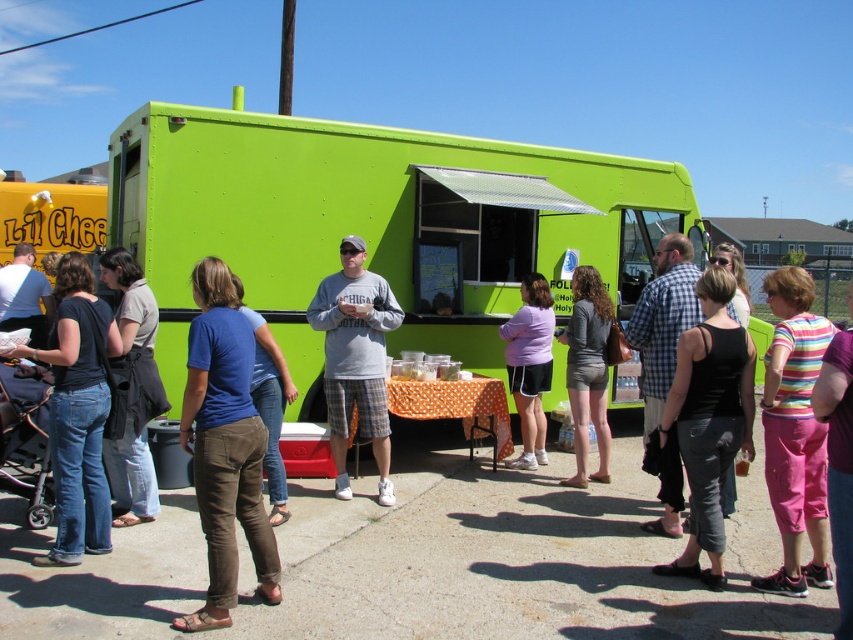
Is gray cotton shirt at center wider than matte purple shirt at center?

Yes, gray cotton shirt at center is wider than matte purple shirt at center.

What do you see at coordinates (355, 358) in the screenshot? I see `gray cotton shirt at center` at bounding box center [355, 358].

Measure the distance between point [345,328] and camera.

20.35 feet

This screenshot has height=640, width=853. In order to click on gray cotton shirt at center in this screenshot , I will do [355, 358].

Can you confirm if gray matte shorts at center is smaller than matte purple shirt at center?

No, gray matte shorts at center is not smaller than matte purple shirt at center.

Which is below, gray matte shorts at center or matte purple shirt at center?

Positioned lower is matte purple shirt at center.

Is point (585, 384) positioned before point (535, 324)?

That is True.

Identify the location of gray matte shorts at center. (587, 371).

Does point (311, 205) come in front of point (791, 396)?

No, (311, 205) is behind (791, 396).

Does green matte food truck at center lie in front of striped fabric shirt at center?

No.

The height and width of the screenshot is (640, 853). What do you see at coordinates (378, 224) in the screenshot?
I see `green matte food truck at center` at bounding box center [378, 224].

The image size is (853, 640). In order to click on green matte food truck at center in this screenshot , I will do `click(378, 224)`.